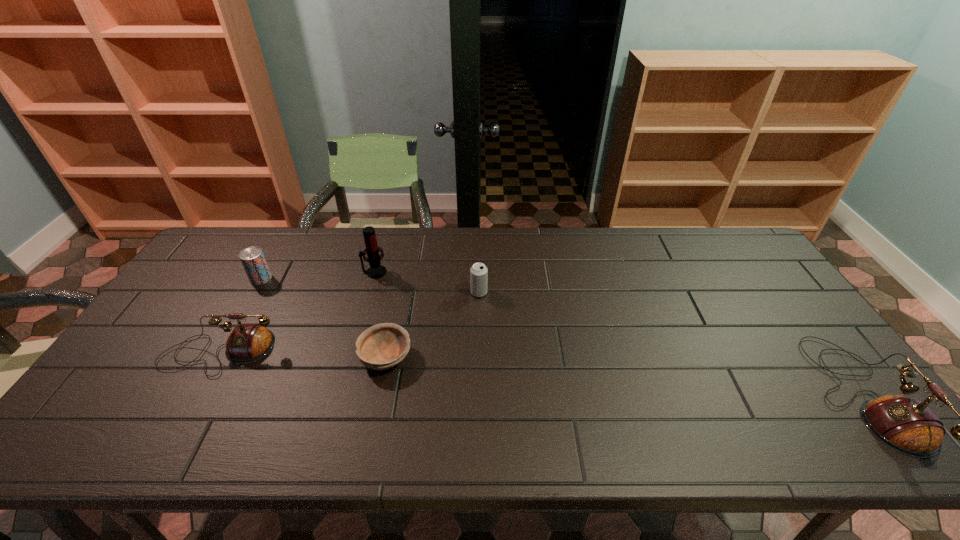
Where is `the left telephone`? The height and width of the screenshot is (540, 960). the left telephone is located at coordinates (248, 342).

You are a GUI agent. You are given a task and a screenshot of the screen. Output one action in this format:
    pyautogui.click(x=<x>, y=<y>)
    Task: Click on the left beer can
    
    Given the screenshot: What is the action you would take?
    pyautogui.click(x=253, y=260)

At what (x,y) coordinates should I click in order to perform the action: click on bowl. Please return your answer as a coordinate pair (x, y). The image size is (960, 540). Looking at the image, I should click on (382, 346).

Image resolution: width=960 pixels, height=540 pixels. Identify the location of the fourth nearest object. (478, 272).

This screenshot has width=960, height=540. I want to click on the second object from right to left, so click(x=478, y=272).

This screenshot has width=960, height=540. Find the location of `microphone`. microphone is located at coordinates (376, 270).

Locate an element on the screen. This screenshot has width=960, height=540. free space located 0.050m on the rotary dial of the shorter telephone is located at coordinates (196, 395).

Find the location of a particular element. vacant space located 0.140m on the left of the farther beer can is located at coordinates (206, 279).

I want to click on vacant space situated 0.100m on the back of the shortest object, so 395,310.

You are a GUI agent. You are given a task and a screenshot of the screen. Output one action in this format:
    pyautogui.click(x=<x>, y=<y>)
    Task: Click on the vacant point located 0.340m on the left of the right beer can
    
    Given the screenshot: What is the action you would take?
    coord(359,292)